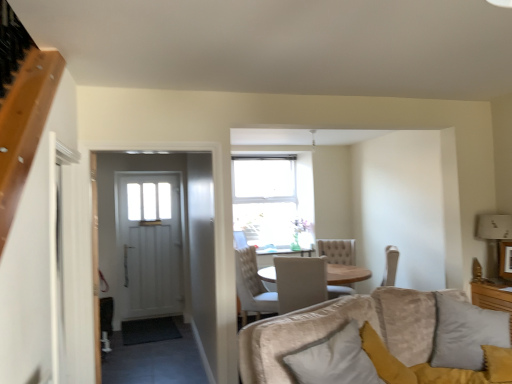
Question: Considering the relative positions of white fabric lampshade at upper right and white soft pillow at lower right, the second pillow positioned from the right, in the image provided, is white fabric lampshade at upper right behind white soft pillow at lower right, the second pillow positioned from the right,?

Choices:
 (A) yes
 (B) no

Answer: (A)

Question: From the image's perspective, is white fabric lampshade at upper right under white soft pillow at lower right, marked as the 1th pillow in a left-to-right arrangement?

Choices:
 (A) yes
 (B) no

Answer: (B)

Question: Is white fabric lampshade at upper right oriented away from white soft pillow at lower right, the second pillow positioned from the right?

Choices:
 (A) yes
 (B) no

Answer: (B)

Question: Can you confirm if white fabric lampshade at upper right is smaller than white soft pillow at lower right, the second pillow positioned from the right?

Choices:
 (A) yes
 (B) no

Answer: (A)

Question: From a real-world perspective, is white fabric lampshade at upper right over white soft pillow at lower right, the second pillow positioned from the right?

Choices:
 (A) no
 (B) yes

Answer: (B)

Question: Is white fabric lampshade at upper right directly adjacent to white soft pillow at lower right, marked as the 1th pillow in a left-to-right arrangement?

Choices:
 (A) yes
 (B) no

Answer: (B)

Question: Considering the relative positions of velvet gray pillow at lower right, which ranks as the first pillow in right-to-left order, and white soft pillow at lower right, the second pillow positioned from the right, in the image provided, is velvet gray pillow at lower right, which ranks as the first pillow in right-to-left order, behind white soft pillow at lower right, the second pillow positioned from the right,?

Choices:
 (A) yes
 (B) no

Answer: (A)

Question: Is velvet gray pillow at lower right, which ranks as the first pillow in right-to-left order, to the left of white soft pillow at lower right, marked as the 1th pillow in a left-to-right arrangement, from the viewer's perspective?

Choices:
 (A) no
 (B) yes

Answer: (A)

Question: Does velvet gray pillow at lower right, which ranks as the 2th pillow in left-to-right order, have a lesser width compared to white soft pillow at lower right, the second pillow positioned from the right?

Choices:
 (A) no
 (B) yes

Answer: (A)

Question: Is velvet gray pillow at lower right, which ranks as the first pillow in right-to-left order, directly adjacent to white soft pillow at lower right, the second pillow positioned from the right?

Choices:
 (A) yes
 (B) no

Answer: (B)

Question: From the image's perspective, is velvet gray pillow at lower right, which ranks as the 2th pillow in left-to-right order, below white soft pillow at lower right, the second pillow positioned from the right?

Choices:
 (A) no
 (B) yes

Answer: (A)

Question: Is velvet gray pillow at lower right, which ranks as the first pillow in right-to-left order, positioned beyond the bounds of white soft pillow at lower right, the second pillow positioned from the right?

Choices:
 (A) yes
 (B) no

Answer: (A)

Question: Considering the relative positions of white soft pillow at lower right, marked as the 1th pillow in a left-to-right arrangement, and velvet gray pillow at lower right, which ranks as the 2th pillow in left-to-right order, in the image provided, is white soft pillow at lower right, marked as the 1th pillow in a left-to-right arrangement, to the left of velvet gray pillow at lower right, which ranks as the 2th pillow in left-to-right order, from the viewer's perspective?

Choices:
 (A) yes
 (B) no

Answer: (A)